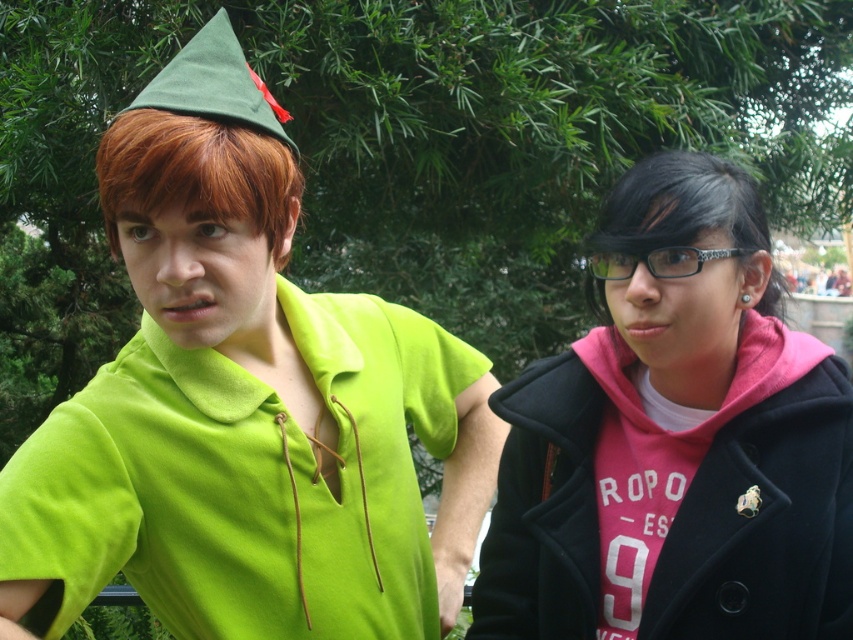
Which of these two, black shiny hair at right or green felt party hat at upper center, stands taller?

black shiny hair at right is taller.

Who is more distant from viewer, (695, 195) or (227, 113)?

The point (695, 195) is more distant.

What do you see at coordinates (679, 208) in the screenshot? This screenshot has height=640, width=853. I see `black shiny hair at right` at bounding box center [679, 208].

Identify the location of black shiny hair at right. The height and width of the screenshot is (640, 853). (679, 208).

Which is above, reddish brown silky hair at left or green felt party hat at upper center?

green felt party hat at upper center is above.

Is reddish brown silky hair at left below green felt party hat at upper center?

Indeed, reddish brown silky hair at left is positioned under green felt party hat at upper center.

The width and height of the screenshot is (853, 640). I want to click on reddish brown silky hair at left, so click(196, 173).

Find the location of a particular element. The image size is (853, 640). reddish brown silky hair at left is located at coordinates click(x=196, y=173).

What do you see at coordinates (675, 440) in the screenshot? Image resolution: width=853 pixels, height=640 pixels. I see `pink fleece hoodie at right` at bounding box center [675, 440].

Can you confirm if pink fleece hoodie at right is taller than black shiny hair at right?

Correct, pink fleece hoodie at right is much taller as black shiny hair at right.

Is point (630, 602) positioned behind point (751, 237)?

Yes, point (630, 602) is behind point (751, 237).

The image size is (853, 640). Find the location of `pink fleece hoodie at right`. pink fleece hoodie at right is located at coordinates (675, 440).